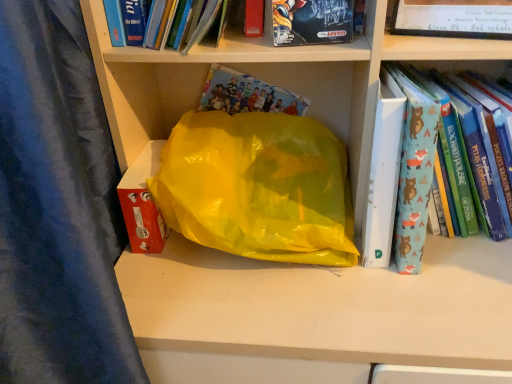
Measure the distance between point (403,217) and camera.

The depth of point (403,217) is 26.89 inches.

At what (x,y) coordinates should I click in order to perform the action: click on blue fabric book at right, which appears as the third book when viewed from the left. Please return your answer as a coordinate pair (x, y). The width and height of the screenshot is (512, 384). Looking at the image, I should click on (445, 161).

Is blue fabric book at right, marked as the 1th book in a right-to-left arrangement, inside or outside of hardcover book at upper center, the third book from the right?

blue fabric book at right, marked as the 1th book in a right-to-left arrangement, is located beyond the bounds of hardcover book at upper center, the third book from the right.

From a real-world perspective, between blue fabric book at right, which appears as the third book when viewed from the left, and hardcover book at upper center, the third book from the right, who is vertically higher?

In real-world perspective, hardcover book at upper center, the third book from the right, is above.

Consider the image. Which point is more distant from viewer, (470, 127) or (134, 22)?

The point (134, 22) is farther from the camera.

Based on their positions, is hardcover book at upper center, the third book from the right, located to the left or right of matt black board game at upper center, which is the second book from right to left?

Clearly, hardcover book at upper center, the third book from the right, is on the left of matt black board game at upper center, which is the second book from right to left, in the image.

From a real-world perspective, which book is the 1st one underneath the hardcover book at upper center, the first book when ordered from left to right? Please provide its 2D coordinates.

[(312, 22)]

From the image's perspective, is hardcover book at upper center, the first book when ordered from left to right, on top of matt black board game at upper center, which is the second book from right to left?

Indeed, from the image's perspective, hardcover book at upper center, the first book when ordered from left to right, is shown above matt black board game at upper center, which is the second book from right to left.

Can you confirm if hardcover book at upper center, the third book from the right, is thinner than matt black board game at upper center, which is the second book from right to left?

In fact, hardcover book at upper center, the third book from the right, might be wider than matt black board game at upper center, which is the second book from right to left.

From a real-world perspective, which book is the 2nd one above the blue fabric book at right, marked as the 1th book in a right-to-left arrangement? Please provide its 2D coordinates.

[(151, 24)]

Is hardcover book at upper center, the first book when ordered from left to right, bigger or smaller than blue fabric book at right, marked as the 1th book in a right-to-left arrangement?

In the image, hardcover book at upper center, the first book when ordered from left to right, appears to be smaller than blue fabric book at right, marked as the 1th book in a right-to-left arrangement.

Is hardcover book at upper center, the first book when ordered from left to right, to the right of blue fabric book at right, which appears as the third book when viewed from the left, from the viewer's perspective?

Incorrect, hardcover book at upper center, the first book when ordered from left to right, is not on the right side of blue fabric book at right, which appears as the third book when viewed from the left.

Can you confirm if matt black board game at upper center, the 2th book from the left, is thinner than blue fabric book at right, which appears as the third book when viewed from the left?

Yes, matt black board game at upper center, the 2th book from the left, is thinner than blue fabric book at right, which appears as the third book when viewed from the left.

Is blue fabric book at right, which appears as the third book when viewed from the left, at the back of matt black board game at upper center, which is the second book from right to left?

No, matt black board game at upper center, which is the second book from right to left,'s orientation is not away from blue fabric book at right, which appears as the third book when viewed from the left.

Can you tell me how much matt black board game at upper center, the 2th book from the left, and blue fabric book at right, which appears as the third book when viewed from the left, differ in facing direction?

8.7 degrees separate the facing orientations of matt black board game at upper center, the 2th book from the left, and blue fabric book at right, which appears as the third book when viewed from the left.

Which is more to the right, matt black board game at upper center, the 2th book from the left, or blue fabric book at right, which appears as the third book when viewed from the left?

blue fabric book at right, which appears as the third book when viewed from the left, is more to the right.

Based on the photo, from the image's perspective, which one is positioned lower, matt black board game at upper center, the 2th book from the left, or hardcover book at upper center, the first book when ordered from left to right?

From the image's view, matt black board game at upper center, the 2th book from the left, is below.

Who is shorter, matt black board game at upper center, the 2th book from the left, or hardcover book at upper center, the third book from the right?

Standing shorter between the two is matt black board game at upper center, the 2th book from the left.

Is point (287, 12) more distant than point (149, 47)?

No.

Does matt black board game at upper center, the 2th book from the left, have a lesser width compared to hardcover book at upper center, the third book from the right?

Correct, the width of matt black board game at upper center, the 2th book from the left, is less than that of hardcover book at upper center, the third book from the right.

Is blue fabric book at right, which appears as the third book when viewed from the left, turned away from matt black board game at upper center, the 2th book from the left?

No, matt black board game at upper center, the 2th book from the left, is not at the back of blue fabric book at right, which appears as the third book when viewed from the left.

Does blue fabric book at right, marked as the 1th book in a right-to-left arrangement, touch matt black board game at upper center, the 2th book from the left?

No, blue fabric book at right, marked as the 1th book in a right-to-left arrangement, is not next to matt black board game at upper center, the 2th book from the left.

Is blue fabric book at right, which appears as the third book when viewed from the left, thinner than matt black board game at upper center, which is the second book from right to left?

No, blue fabric book at right, which appears as the third book when viewed from the left, is not thinner than matt black board game at upper center, which is the second book from right to left.

Between blue fabric book at right, which appears as the third book when viewed from the left, and matt black board game at upper center, the 2th book from the left, which one is positioned in front?

matt black board game at upper center, the 2th book from the left.

From the image's perspective, which book is the 2nd one above the blue fabric book at right, which appears as the third book when viewed from the left? Please provide its 2D coordinates.

[(151, 24)]

Locate an element on the screen. the 1st book to the right of the hardcover book at upper center, the first book when ordered from left to right, counting from the anchor's position is located at coordinates (312, 22).

Estimate the real-world distances between objects in this image. Which object is further from matt black board game at upper center, the 2th book from the left, blue fabric book at right, which appears as the third book when viewed from the left, or hardcover book at upper center, the first book when ordered from left to right?

blue fabric book at right, which appears as the third book when viewed from the left, is positioned further to the anchor matt black board game at upper center, the 2th book from the left.

Estimate the real-world distances between objects in this image. Which object is further from blue fabric book at right, which appears as the third book when viewed from the left, matt black board game at upper center, the 2th book from the left, or hardcover book at upper center, the first book when ordered from left to right?

hardcover book at upper center, the first book when ordered from left to right, is positioned further to the anchor blue fabric book at right, which appears as the third book when viewed from the left.

Estimate the real-world distances between objects in this image. Which object is further from blue fabric book at right, marked as the 1th book in a right-to-left arrangement, hardcover book at upper center, the third book from the right, or matt black board game at upper center, the 2th book from the left?

The object further to blue fabric book at right, marked as the 1th book in a right-to-left arrangement, is hardcover book at upper center, the third book from the right.

Looking at the image, which one is located closer to hardcover book at upper center, the third book from the right, blue fabric book at right, marked as the 1th book in a right-to-left arrangement, or matt black board game at upper center, which is the second book from right to left?

Based on the image, matt black board game at upper center, which is the second book from right to left, appears to be nearer to hardcover book at upper center, the third book from the right.

Based on their spatial positions, is matt black board game at upper center, the 2th book from the left, or blue fabric book at right, marked as the 1th book in a right-to-left arrangement, further from hardcover book at upper center, the third book from the right?

blue fabric book at right, marked as the 1th book in a right-to-left arrangement, is further to hardcover book at upper center, the third book from the right.

Which object lies nearer to the anchor point matt black board game at upper center, which is the second book from right to left, hardcover book at upper center, the first book when ordered from left to right, or blue fabric book at right, marked as the 1th book in a right-to-left arrangement?

hardcover book at upper center, the first book when ordered from left to right.

Locate an element on the screen. The image size is (512, 384). book located between hardcover book at upper center, the first book when ordered from left to right, and blue fabric book at right, which appears as the third book when viewed from the left, in the left-right direction is located at coordinates pos(312,22).